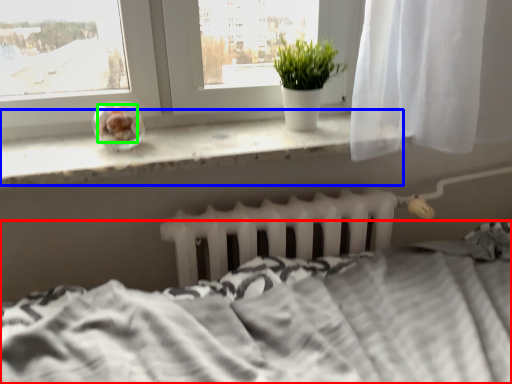
Question: Considering the real-world distances, which object is farthest from bed (highlighted by a red box)? window sill (highlighted by a blue box) or food (highlighted by a green box)?

Choices:
 (A) window sill
 (B) food

Answer: (B)